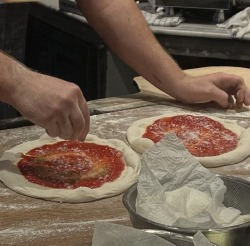
This screenshot has width=250, height=246. I want to click on tea towel, so click(241, 19), click(169, 18), click(149, 16).